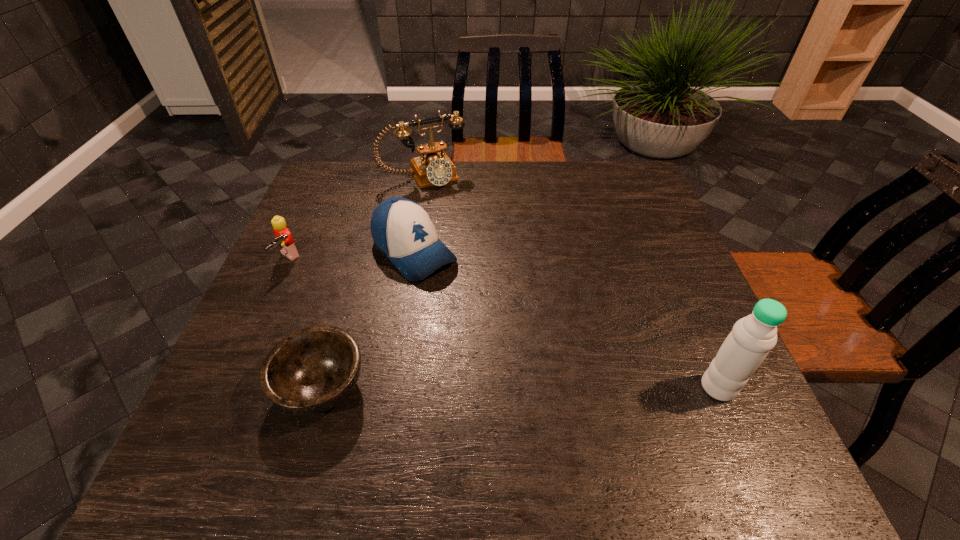
Where is `water bottle present at the near edge`? water bottle present at the near edge is located at coordinates (x=752, y=337).

You are a GUI agent. You are given a task and a screenshot of the screen. Output one action in this format:
    pyautogui.click(x=<x>, y=<y>)
    Task: Click on the bowl at the left edge
    This screenshot has width=960, height=540.
    Given the screenshot: What is the action you would take?
    pyautogui.click(x=312, y=370)

Where is `Lego at the left edge`? Lego at the left edge is located at coordinates (284, 239).

The width and height of the screenshot is (960, 540). What are the coordinates of `object at the right edge` in the screenshot? It's located at (752, 337).

Locate an element on the screen. The image size is (960, 540). object at the near left corner is located at coordinates (312, 370).

At what (x,y) coordinates should I click in order to perform the action: click on object that is at the near right corner. Please return your answer as a coordinate pair (x, y). This screenshot has width=960, height=540. Looking at the image, I should click on (752, 337).

The image size is (960, 540). Find the location of `vacant space at the far edge of the desktop`. vacant space at the far edge of the desktop is located at coordinates (409, 195).

Locate an element on the screen. The image size is (960, 540). vacant space at the left edge of the desktop is located at coordinates pyautogui.click(x=286, y=271).

Find the location of a particular element. free region at the right edge of the desktop is located at coordinates (678, 293).

You are a GUI agent. You are given a task and a screenshot of the screen. Output one action in this format:
    pyautogui.click(x=<x>, y=<y>)
    Task: Click on the free region at the far left corner of the desktop
    This screenshot has width=960, height=540.
    Given the screenshot: What is the action you would take?
    pyautogui.click(x=338, y=198)